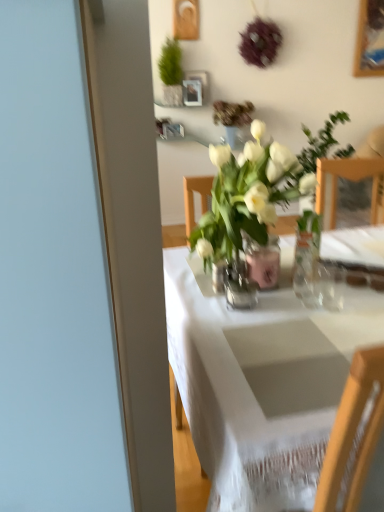
Question: Should I look upward or downward to see white glass vase at center, which is counted as the first houseplant, starting from the right?

Choices:
 (A) down
 (B) up

Answer: (B)

Question: Is green matte plant at upper center, the first houseplant positioned from the left, inside white cloth table at center?

Choices:
 (A) no
 (B) yes

Answer: (A)

Question: Considering the relative positions of white cloth table at center and green matte plant at upper center, acting as the 2th houseplant starting from the bottom, in the image provided, is white cloth table at center in front of green matte plant at upper center, acting as the 2th houseplant starting from the bottom,?

Choices:
 (A) yes
 (B) no

Answer: (A)

Question: Considering the relative sizes of white cloth table at center and green matte plant at upper center, which is the 2th houseplant in right-to-left order, in the image provided, is white cloth table at center taller than green matte plant at upper center, which is the 2th houseplant in right-to-left order,?

Choices:
 (A) no
 (B) yes

Answer: (B)

Question: Could you tell me if white cloth table at center is facing green matte plant at upper center, acting as the 2th houseplant starting from the bottom?

Choices:
 (A) yes
 (B) no

Answer: (B)

Question: From the image's perspective, would you say white cloth table at center is positioned over green matte plant at upper center, the first houseplant positioned from the left?

Choices:
 (A) yes
 (B) no

Answer: (B)

Question: Can you see white cloth table at center touching green matte plant at upper center, which is the first houseplant from back to front?

Choices:
 (A) yes
 (B) no

Answer: (B)

Question: Are white cloth table at center and white glass vase at center, which ranks as the second houseplant in top-to-bottom order, making contact?

Choices:
 (A) no
 (B) yes

Answer: (A)

Question: Is white cloth table at center behind white glass vase at center, which is the second houseplant in left-to-right order?

Choices:
 (A) yes
 (B) no

Answer: (B)

Question: Can you confirm if white cloth table at center is taller than white glass vase at center, the 2th houseplant viewed from the back?

Choices:
 (A) yes
 (B) no

Answer: (A)

Question: Is white cloth table at center aimed at white glass vase at center, which ranks as the second houseplant in top-to-bottom order?

Choices:
 (A) no
 (B) yes

Answer: (A)

Question: Is white cloth table at center positioned before white glass vase at center, which ranks as the second houseplant in top-to-bottom order?

Choices:
 (A) no
 (B) yes

Answer: (B)

Question: Is white cloth table at center oriented away from white glass vase at center, which is the second houseplant in left-to-right order?

Choices:
 (A) no
 (B) yes

Answer: (A)

Question: From the image's perspective, does green matte plant at upper center, which is the 2th houseplant in right-to-left order, appear higher than clear glass vase at center, acting as the first vase starting from the front?

Choices:
 (A) yes
 (B) no

Answer: (A)